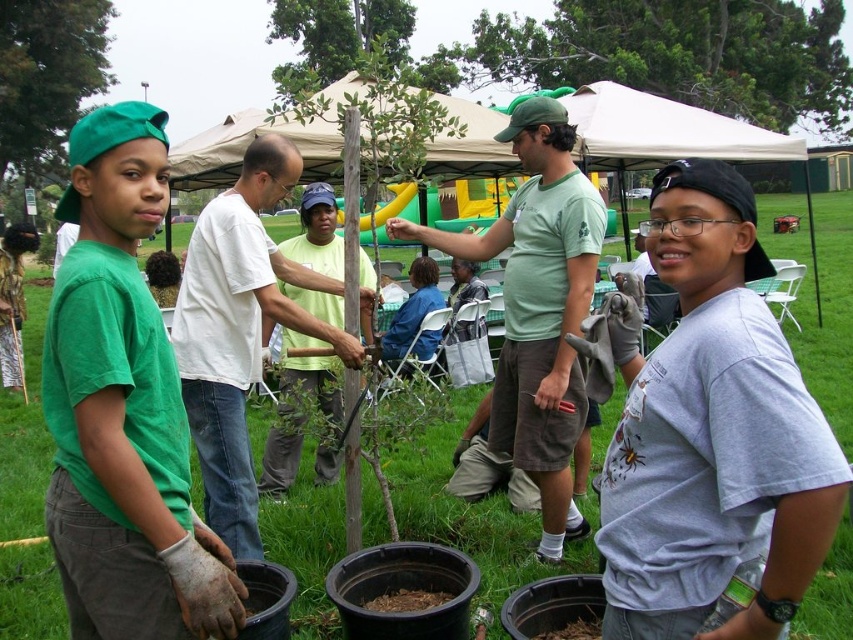
You are a photographer standing at the edge of the field. You want to take a photo that includes both the green matte shirt at center and the white cotton shirt at center. The camera you are using has a maximum focus range of 3 feet. Will both subjects be in focus?

The distance between the green matte shirt at center and the white cotton shirt at center is 3.54 feet, which exceeds the camera maximum focus range of 3 feet. Therefore, both subjects cannot be in focus simultaneously.

You are a photographer standing at the edge of the grassy field and want to take a photo of both the green matte shirt at center and the white cotton shirt at center. Which of the two shirts will appear larger in the photo?

The green matte shirt at center will appear larger in the photo because it is closer to the viewer than the white cotton shirt at center.